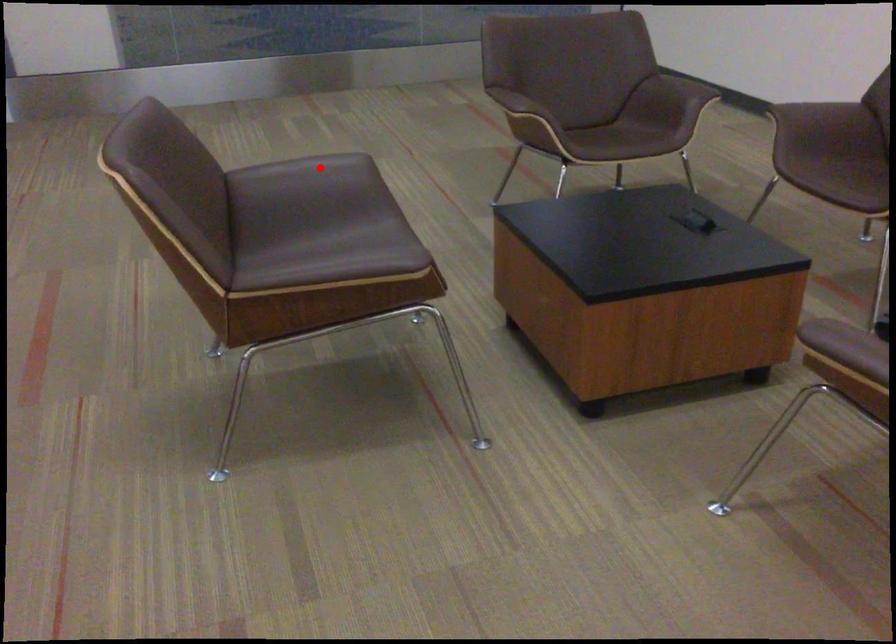
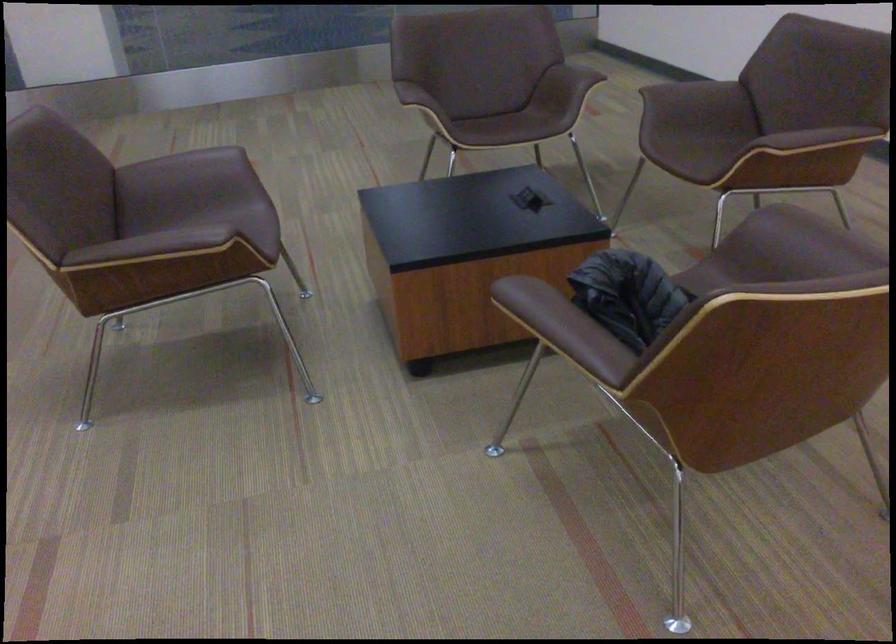
Find the pixel in the second image that matches the highlighted location in the first image.

(193, 162)